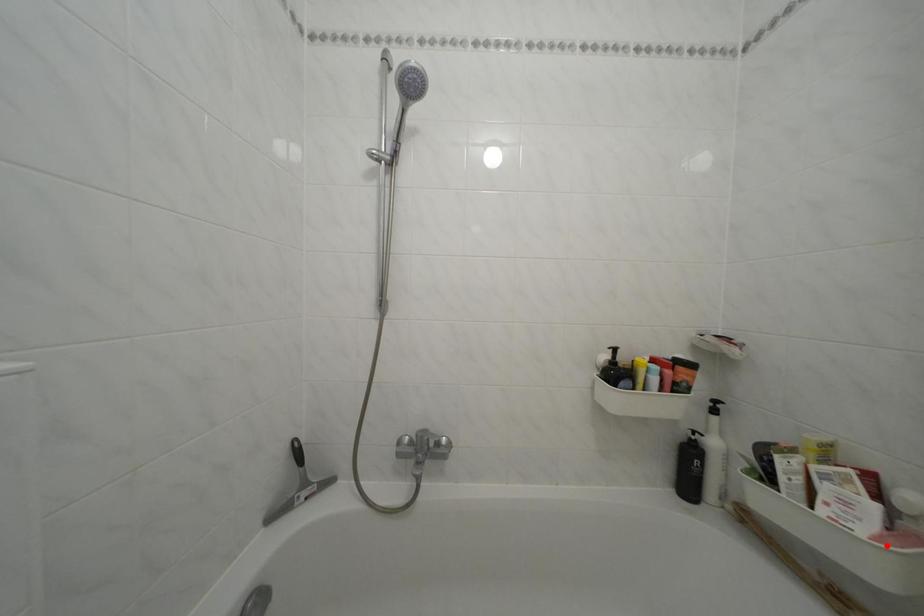
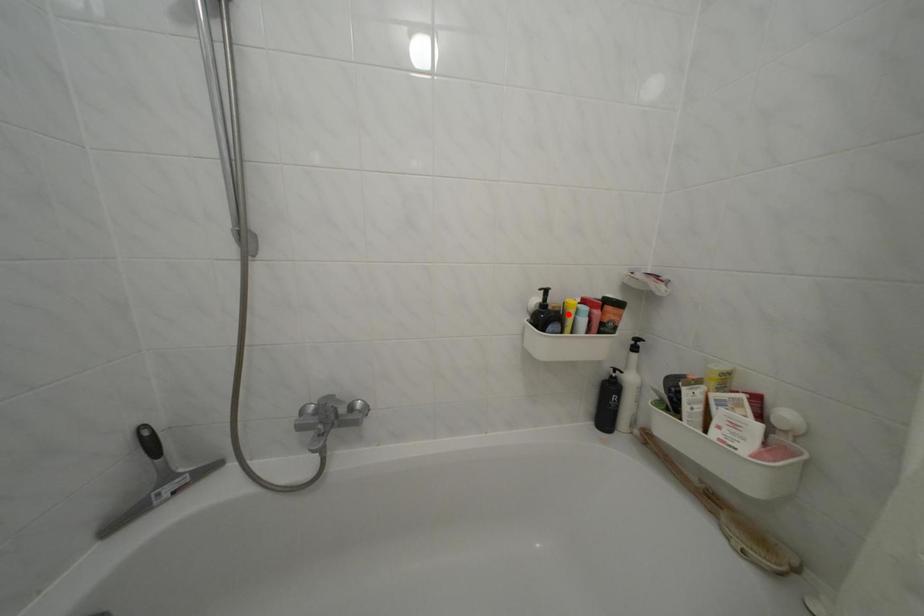
I am providing you with two images of the same scene from different viewpoints. A red point is marked on the first image and another point is marked on the second image. Are the points marked in image1 and image2 representing the same 3D position?

No